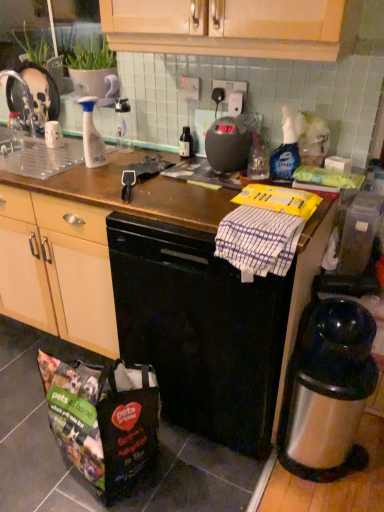
Where is `blank space situated above brown wooden counter top at center (from a real-world perspective)`? blank space situated above brown wooden counter top at center (from a real-world perspective) is located at coordinates (153, 174).